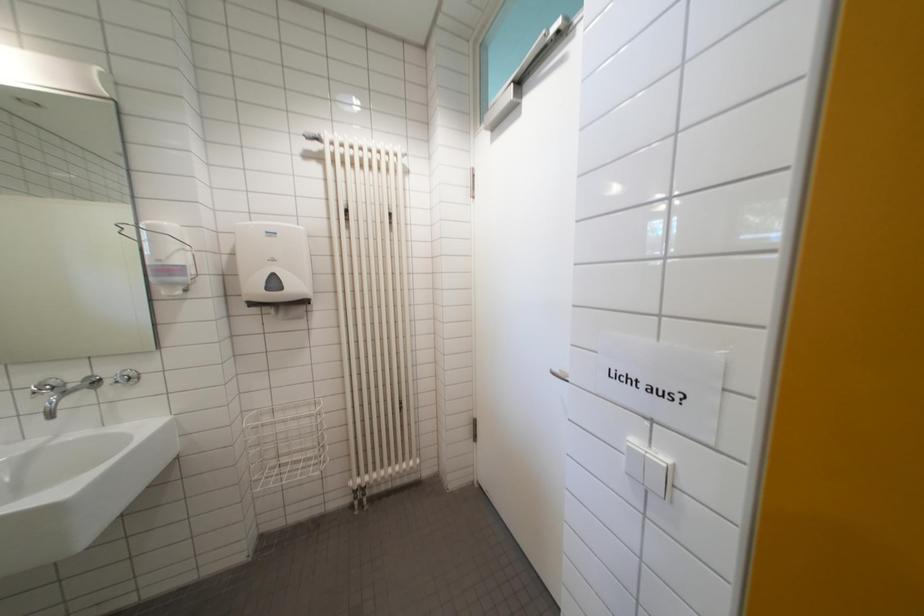
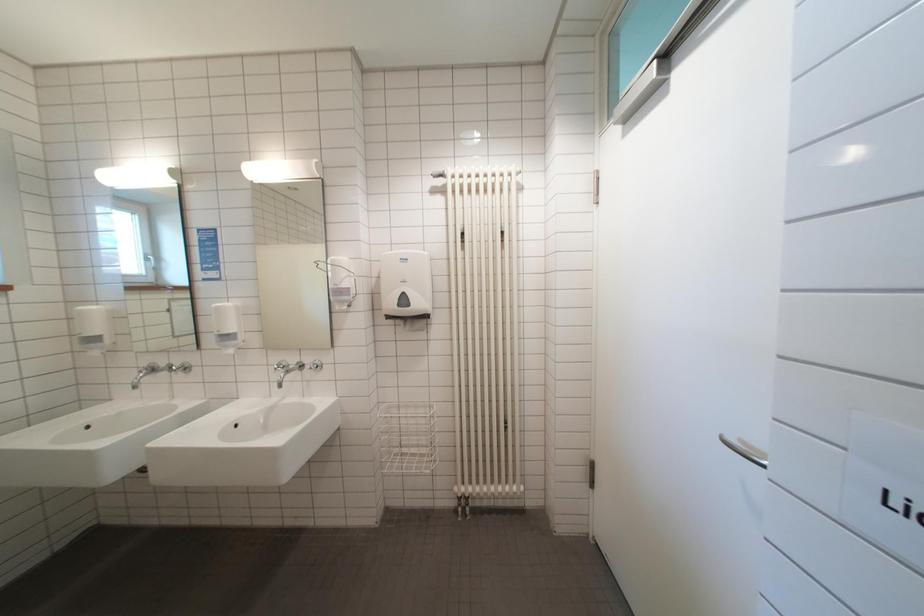
The images are taken continuously from a first-person perspective. In which direction are you moving?

The movement direction of the cameraman is right, forward.